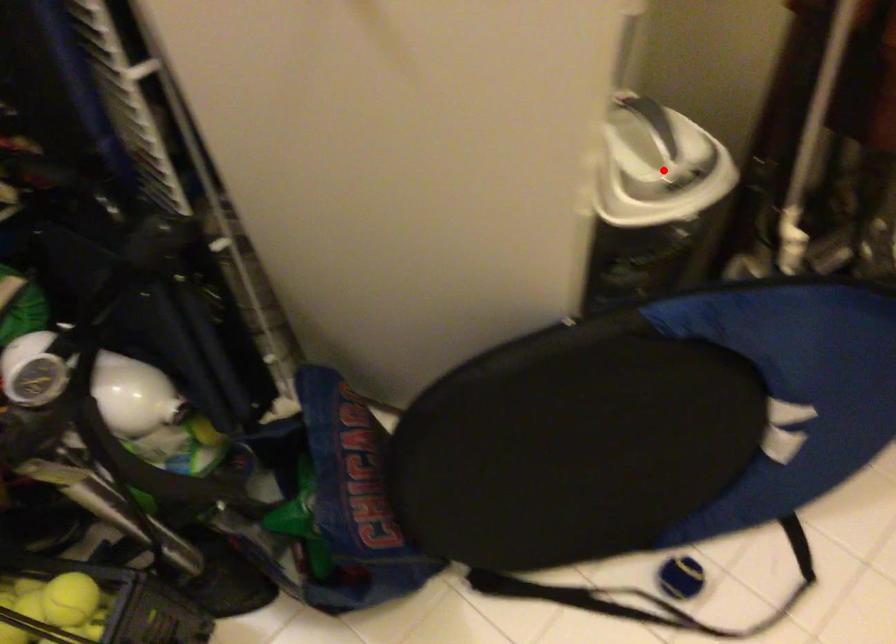
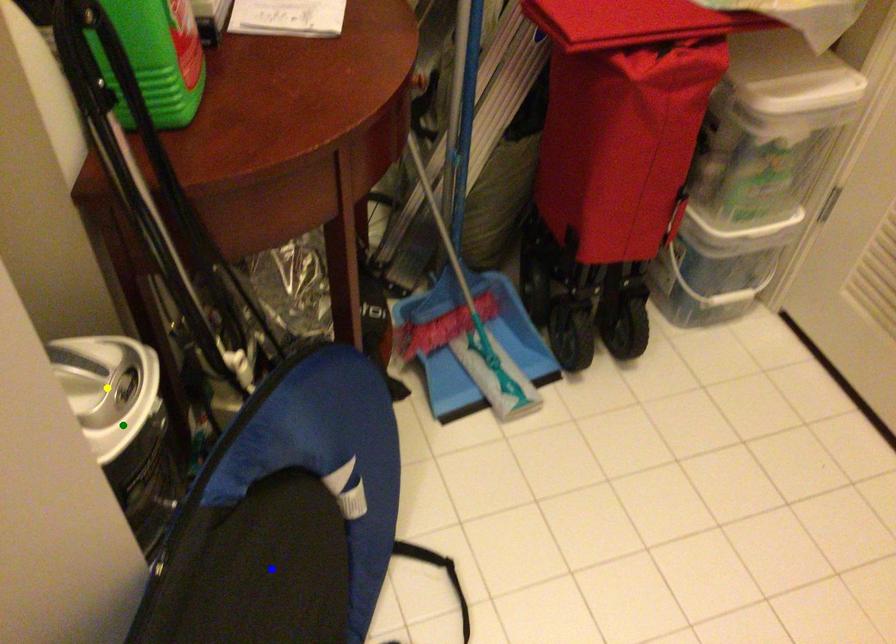
Question: I am providing you with two images of the same scene from different viewpoints. A red point is marked on the first image. You are given multiple points on the second image. In image 2, which mark is for the same physical point as the one in image 1?

Choices:
 (A) yellow point
 (B) blue point
 (C) green point

Answer: (A)